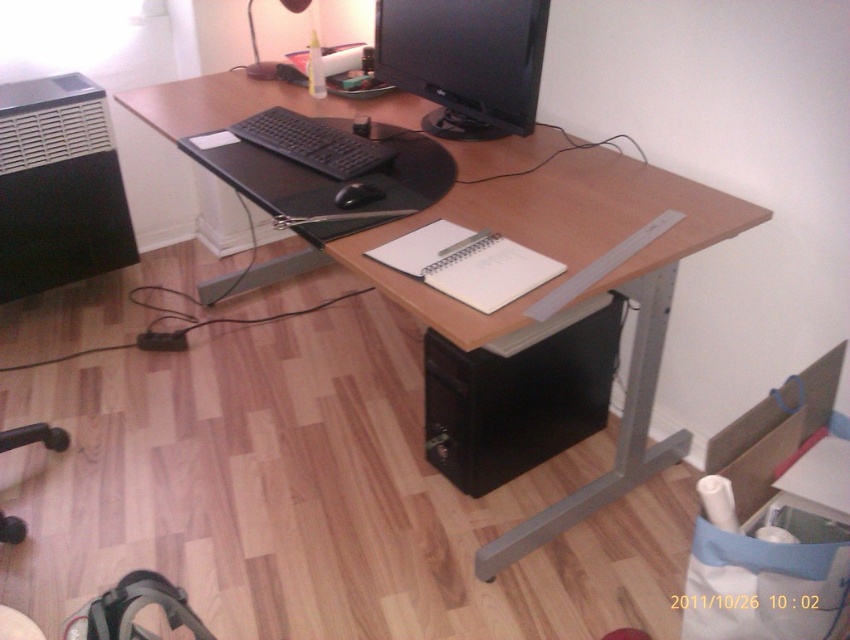
The image size is (850, 640). Find the location of `black glossy monitor at upper center`. black glossy monitor at upper center is located at coordinates (465, 61).

Who is taller, black glossy monitor at upper center or black plastic swivel chair at lower left?

With more height is black glossy monitor at upper center.

Does point (518, 35) lie in front of point (10, 436)?

Yes, it is in front of point (10, 436).

Locate an element on the screen. This screenshot has height=640, width=850. black glossy monitor at upper center is located at coordinates (465, 61).

Does black plastic swivel chair at lower left appear over black matte mouse at center?

Actually, black plastic swivel chair at lower left is below black matte mouse at center.

Does black plastic swivel chair at lower left have a larger size compared to black matte mouse at center?

Yes, black plastic swivel chair at lower left is bigger than black matte mouse at center.

The image size is (850, 640). Describe the element at coordinates (34, 436) in the screenshot. I see `black plastic swivel chair at lower left` at that location.

At what (x,y) coordinates should I click in order to perform the action: click on black plastic swivel chair at lower left. Please return your answer as a coordinate pair (x, y). The image size is (850, 640). Looking at the image, I should click on (34, 436).

Which is behind, point (384, 275) or point (405, 52)?

The point (405, 52) is more distant.

What do you see at coordinates (558, 280) in the screenshot? I see `wooden computer desk at center` at bounding box center [558, 280].

This screenshot has height=640, width=850. Find the location of `wooden computer desk at center`. wooden computer desk at center is located at coordinates (558, 280).